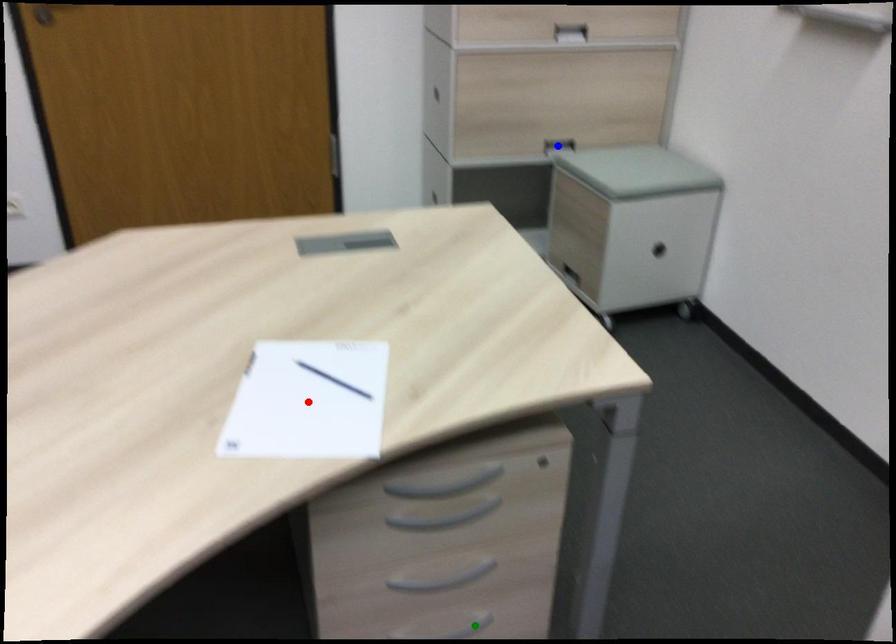
Order these from nearest to farthest:
1. blue point
2. green point
3. red point

blue point, green point, red point